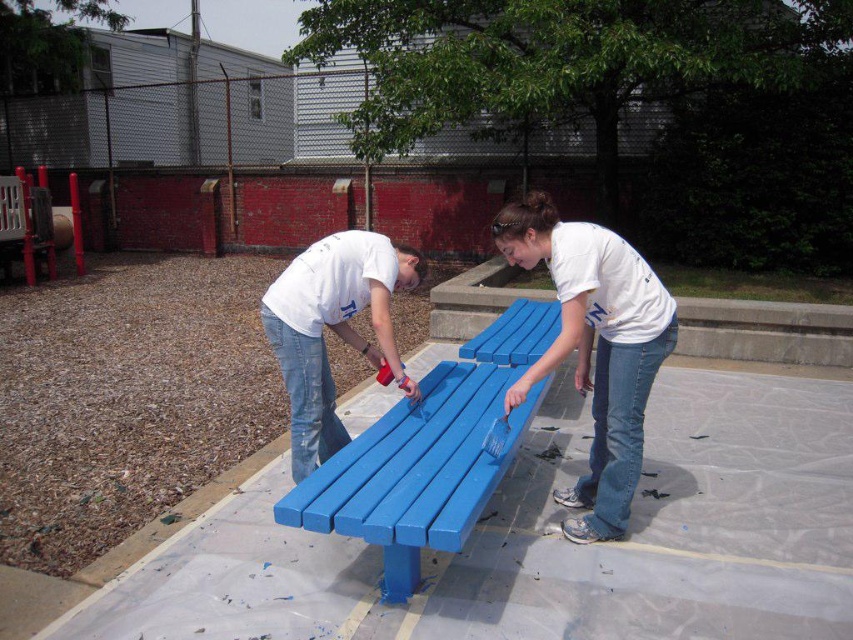
Can you confirm if matte plastic bench at center is positioned below blue painted wood bench at center?

No.

Can you confirm if matte plastic bench at center is bigger than blue painted wood bench at center?

Correct, matte plastic bench at center is larger in size than blue painted wood bench at center.

Which is behind, point (532, 262) or point (453, 432)?

Point (532, 262)

Find the location of `matte plastic bench at center`. matte plastic bench at center is located at coordinates (508, 404).